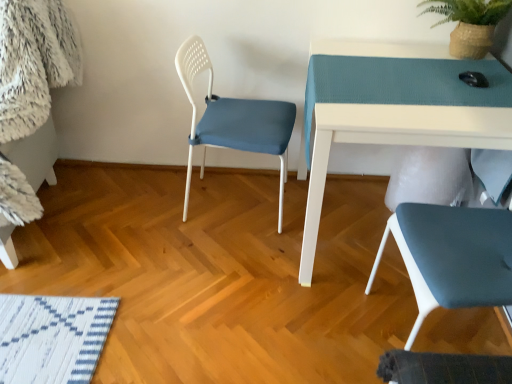
The width and height of the screenshot is (512, 384). I want to click on vacant space underneath white plastic chair at center, which is the second chair from right to left (from a real-world perspective), so click(234, 208).